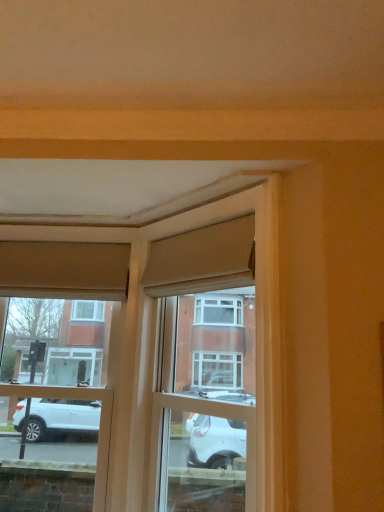
Question: Is the depth of matte beige curtain at upper center, the first curtain positioned from the right, greater than that of matte beige curtain at upper left, marked as the 1th curtain in a back-to-front arrangement?

Choices:
 (A) yes
 (B) no

Answer: (B)

Question: From a real-world perspective, is matte beige curtain at upper center, which is counted as the second curtain, starting from the back, physically above matte beige curtain at upper left, which is the first curtain from left to right?

Choices:
 (A) yes
 (B) no

Answer: (A)

Question: From the image's perspective, is matte beige curtain at upper center, the second curtain in the left-to-right sequence, on top of matte beige curtain at upper left, marked as the 2th curtain in a front-to-back arrangement?

Choices:
 (A) no
 (B) yes

Answer: (B)

Question: Considering the relative sizes of matte beige curtain at upper center, the first curtain positioned from the right, and matte beige curtain at upper left, marked as the 2th curtain in a front-to-back arrangement, in the image provided, is matte beige curtain at upper center, the first curtain positioned from the right, thinner than matte beige curtain at upper left, marked as the 2th curtain in a front-to-back arrangement,?

Choices:
 (A) no
 (B) yes

Answer: (B)

Question: Does matte beige curtain at upper center, the second curtain in the left-to-right sequence, have a smaller size compared to matte beige curtain at upper left, marked as the 1th curtain in a back-to-front arrangement?

Choices:
 (A) yes
 (B) no

Answer: (A)

Question: In terms of size, does matte beige curtain at upper center, acting as the 1th curtain starting from the front, appear bigger or smaller than matte beige curtain at upper left, marked as the 1th curtain in a back-to-front arrangement?

Choices:
 (A) small
 (B) big

Answer: (A)

Question: Is matte beige curtain at upper center, the second curtain in the left-to-right sequence, taller or shorter than matte beige curtain at upper left, marked as the 2th curtain in a front-to-back arrangement?

Choices:
 (A) tall
 (B) short

Answer: (B)

Question: Is matte beige curtain at upper center, which is counted as the second curtain, starting from the back, wider or thinner than matte beige curtain at upper left, marked as the 1th curtain in a back-to-front arrangement?

Choices:
 (A) wide
 (B) thin

Answer: (B)

Question: From the image's perspective, is matte beige curtain at upper center, acting as the 1th curtain starting from the front, located above or below matte beige curtain at upper left, which is the first curtain from left to right?

Choices:
 (A) below
 (B) above

Answer: (B)

Question: Considering the positions of matte glass window at center and matte beige curtain at upper center, which is counted as the second curtain, starting from the back, in the image, is matte glass window at center taller or shorter than matte beige curtain at upper center, which is counted as the second curtain, starting from the back,?

Choices:
 (A) tall
 (B) short

Answer: (A)

Question: From a real-world perspective, is matte glass window at center above or below matte beige curtain at upper center, which is counted as the second curtain, starting from the back?

Choices:
 (A) above
 (B) below

Answer: (B)

Question: Is matte glass window at center wider or thinner than matte beige curtain at upper center, the second curtain in the left-to-right sequence?

Choices:
 (A) thin
 (B) wide

Answer: (B)

Question: Choose the correct answer: Is matte glass window at center inside matte beige curtain at upper center, which is counted as the second curtain, starting from the back, or outside it?

Choices:
 (A) outside
 (B) inside

Answer: (A)

Question: From the image's perspective, is matte beige curtain at upper left, which is the first curtain from left to right, located above or below matte wood window frame at center?

Choices:
 (A) below
 (B) above

Answer: (B)

Question: Considering the positions of matte beige curtain at upper left, marked as the 2th curtain in a front-to-back arrangement, and matte wood window frame at center in the image, is matte beige curtain at upper left, marked as the 2th curtain in a front-to-back arrangement, wider or thinner than matte wood window frame at center?

Choices:
 (A) thin
 (B) wide

Answer: (A)